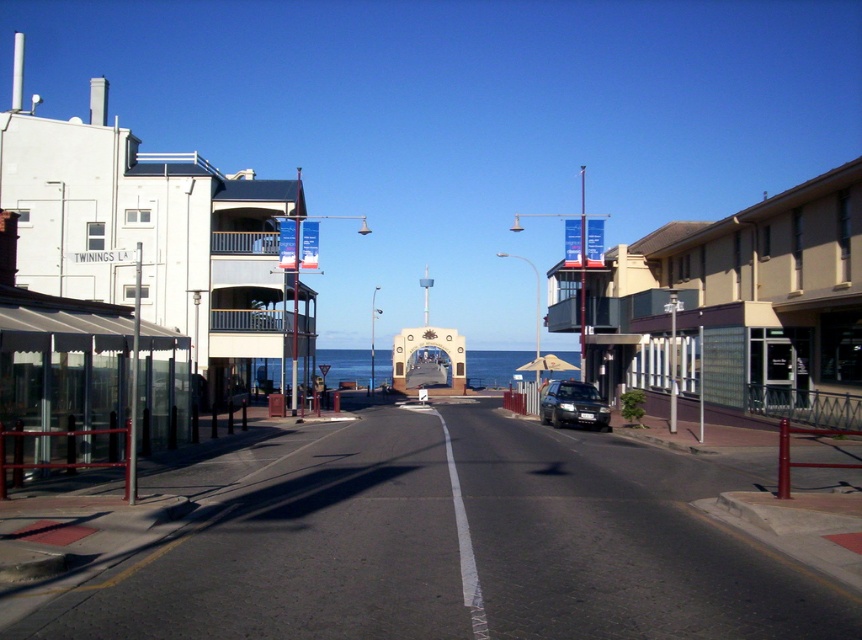
Question: Is beige concrete building at right to the right of satin silver sedan at center from the viewer's perspective?

Choices:
 (A) no
 (B) yes

Answer: (B)

Question: Observing the image, what is the correct spatial positioning of beige concrete building at right in reference to satin silver sedan at center?

Choices:
 (A) left
 (B) right

Answer: (B)

Question: Which point is farther from the camera taking this photo?

Choices:
 (A) (592, 413)
 (B) (548, 330)

Answer: (B)

Question: Does beige concrete building at right appear on the right side of satin silver sedan at center?

Choices:
 (A) no
 (B) yes

Answer: (B)